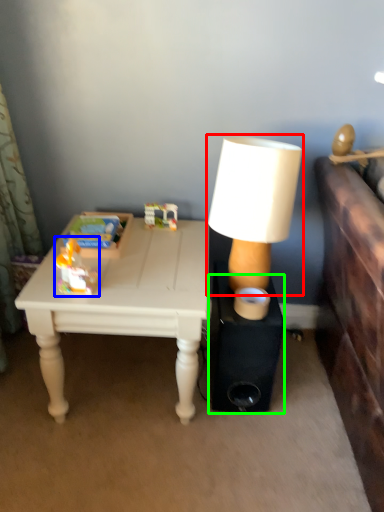
Question: Based on their relative distances, which object is farther from lamp (highlighted by a red box)? Choose from toy (highlighted by a blue box) and speaker (highlighted by a green box).

Choices:
 (A) toy
 (B) speaker

Answer: (A)